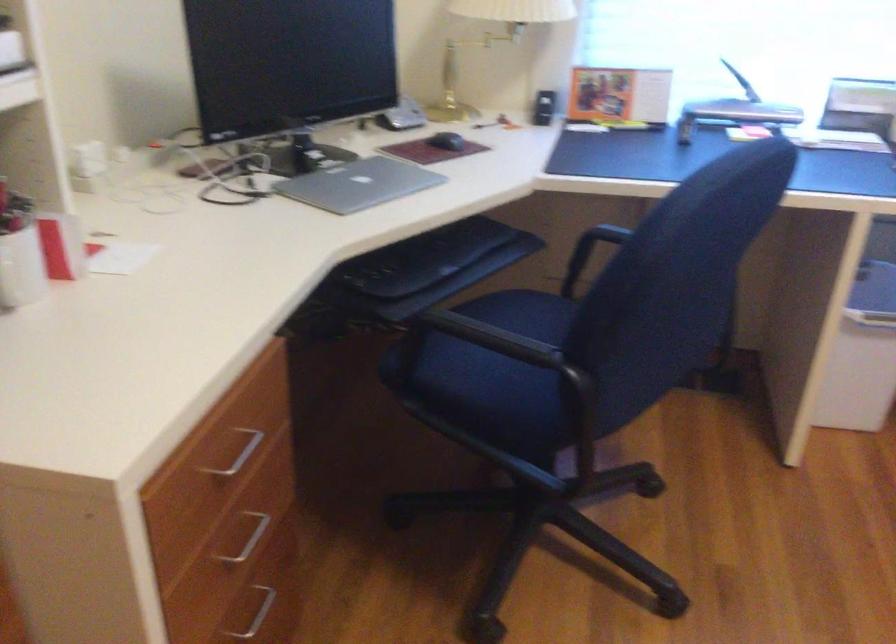
Find the location of a particular element. This screenshot has width=896, height=644. blue chair sitting surface is located at coordinates (484, 359).